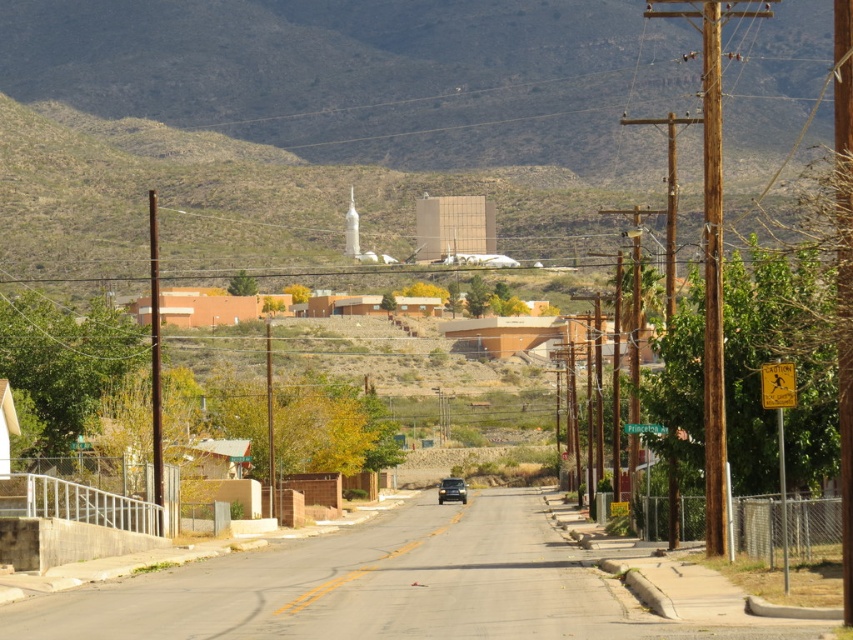
Question: Considering the relative positions of brown rocky mountain at upper center and orange stucco buildings at center in the image provided, where is brown rocky mountain at upper center located with respect to orange stucco buildings at center?

Choices:
 (A) above
 (B) below

Answer: (A)

Question: Which object appears closest to the camera in this image?

Choices:
 (A) brown rocky mountain at upper center
 (B) orange stucco buildings at center

Answer: (B)

Question: Considering the real-world distances, which object is farthest from the brown rocky mountain at upper center?

Choices:
 (A) orange stucco buildings at center
 (B) metallic gold suv at center

Answer: (B)

Question: Can you confirm if brown rocky mountain at upper center is smaller than orange stucco buildings at center?

Choices:
 (A) yes
 (B) no

Answer: (B)

Question: Considering the real-world distances, which object is closest to the metallic gold suv at center?

Choices:
 (A) orange stucco buildings at center
 (B) brown rocky mountain at upper center

Answer: (A)

Question: From the image, what is the correct spatial relationship of brown rocky mountain at upper center in relation to orange stucco buildings at center?

Choices:
 (A) right
 (B) left

Answer: (B)